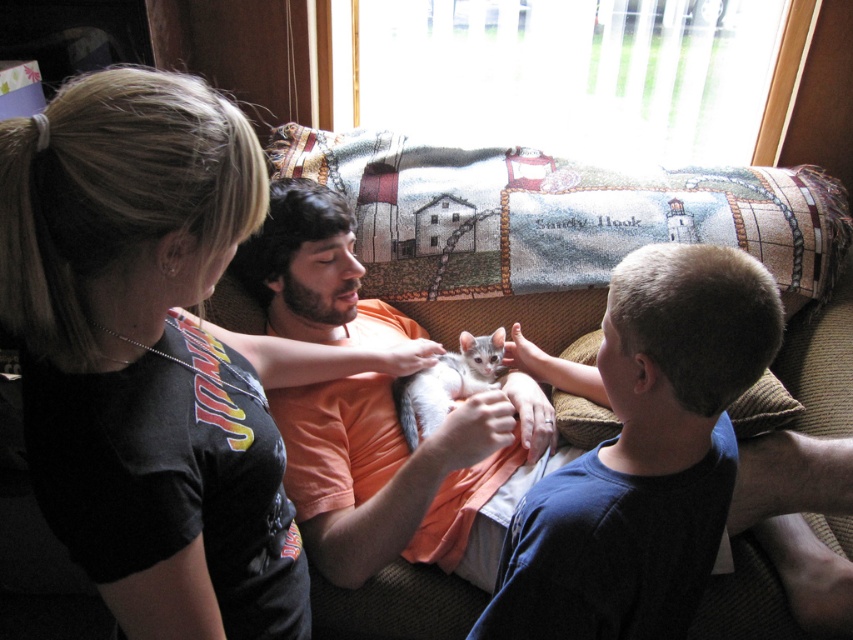
From the picture: Is smooth blue shirt at center bigger than textured fabric couch at center?

Incorrect, smooth blue shirt at center is not larger than textured fabric couch at center.

Is smooth blue shirt at center wider than textured fabric couch at center?

No.

Image resolution: width=853 pixels, height=640 pixels. Identify the location of smooth blue shirt at center. (643, 458).

Identify the location of smooth blue shirt at center. Image resolution: width=853 pixels, height=640 pixels. (643, 458).

Does point (683, 336) lie behind point (320, 509)?

No, it is in front of (320, 509).

Is point (732, 289) positioned after point (312, 244)?

No, (732, 289) is in front of (312, 244).

This screenshot has height=640, width=853. In order to click on smooth blue shirt at center in this screenshot , I will do `click(643, 458)`.

Looking at this image, which is more to the left, textured fabric couch at center or gray fur cat at center?

gray fur cat at center

In the scene shown: Which is below, textured fabric couch at center or gray fur cat at center?

gray fur cat at center is lower down.

The height and width of the screenshot is (640, 853). I want to click on textured fabric couch at center, so click(x=337, y=444).